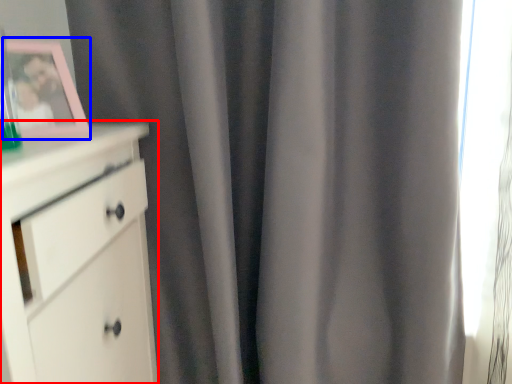
Question: Which of the following is the closest to the observer, chest of drawers (highlighted by a red box) or picture frame (highlighted by a blue box)?

Choices:
 (A) chest of drawers
 (B) picture frame

Answer: (A)